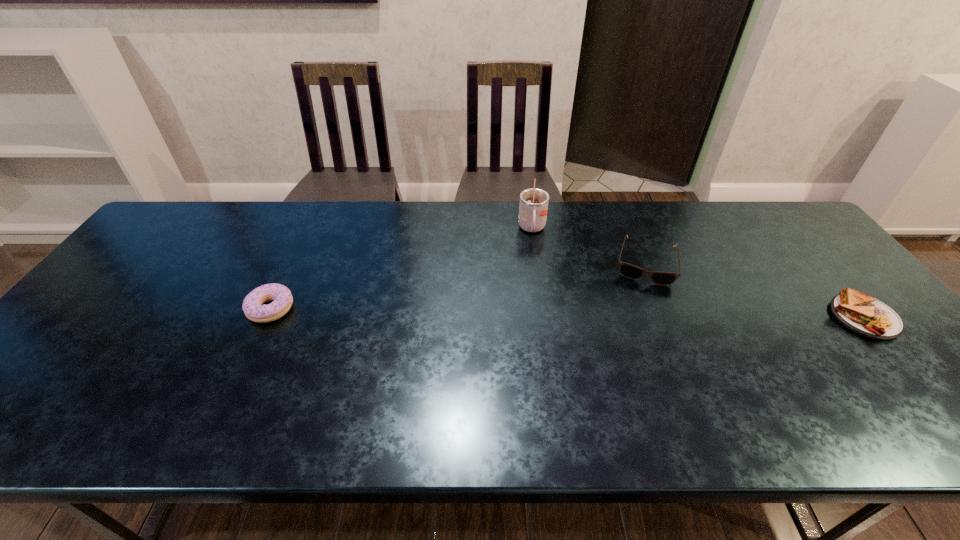
At what (x,y) coordinates should I click in order to perform the action: click on free spot located 0.340m on the lenses of the sunglasses. Please return your answer as a coordinate pair (x, y). Image resolution: width=960 pixels, height=540 pixels. Looking at the image, I should click on (631, 386).

Where is `blank space located 0.290m on the lenses of the sunglasses`? This screenshot has width=960, height=540. blank space located 0.290m on the lenses of the sunglasses is located at coordinates (633, 368).

Identify the location of vacant region located 0.160m on the lenses of the sunglasses. This screenshot has width=960, height=540. 637,327.

Find the location of a particular element. cup that is positioned at the far edge is located at coordinates (533, 208).

You are a GUI agent. You are given a task and a screenshot of the screen. Output one action in this format:
    pyautogui.click(x=<x>, y=<y>)
    Task: Click on the sunglasses located at the far edge
    
    Given the screenshot: What is the action you would take?
    pyautogui.click(x=630, y=271)

This screenshot has width=960, height=540. Identify the location of object present at the right edge. (861, 313).

Image resolution: width=960 pixels, height=540 pixels. What are the coordinates of `free space at the far edge of the desktop` in the screenshot? It's located at (252, 225).

What are the coordinates of `free space at the near edge of the desktop` in the screenshot? It's located at (280, 367).

You are a GUI agent. You are given a task and a screenshot of the screen. Output one action in this format:
    pyautogui.click(x=<x>, y=<y>)
    Task: Click on the free space at the right edge of the desktop
    The height and width of the screenshot is (540, 960).
    Given the screenshot: What is the action you would take?
    pyautogui.click(x=817, y=273)

The width and height of the screenshot is (960, 540). I want to click on free space at the far left corner, so click(x=197, y=234).